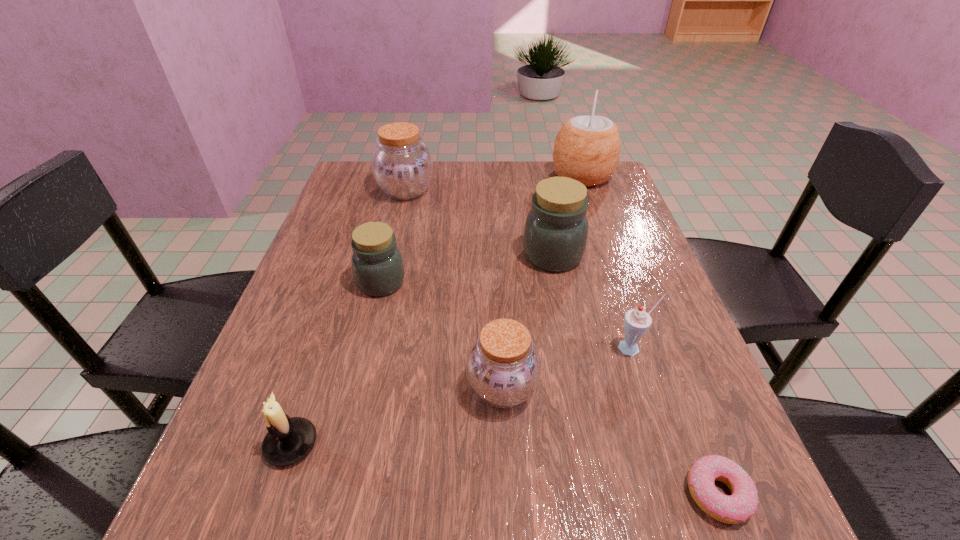
You are a GUI agent. You are given a task and a screenshot of the screen. Output one action in this format:
    pyautogui.click(x=<x>, y=<y>)
    Task: Click on the coconut located in the far edge section of the desktop
    Image resolution: width=960 pixels, height=540 pixels.
    Given the screenshot: What is the action you would take?
    pyautogui.click(x=587, y=148)

This screenshot has height=540, width=960. I want to click on jar that is at the far edge, so click(x=402, y=165).

Locate an element on the screen. The width and height of the screenshot is (960, 540). object that is at the near edge is located at coordinates (742, 504).

Identify the location of candle holder present at the left edge. (288, 440).

The width and height of the screenshot is (960, 540). What are the coordinates of `coconut that is at the right edge` in the screenshot? It's located at (587, 148).

Where is `jar positioned at the right edge`? jar positioned at the right edge is located at coordinates (556, 229).

What are the coordinates of `milkshake at the right edge` in the screenshot? It's located at (636, 321).

Identify the location of doughnut situated at the right edge. Image resolution: width=960 pixels, height=540 pixels. (742, 504).

This screenshot has width=960, height=540. Identify the location of object that is at the far left corner. (402, 165).

Locate an element on the screen. The image size is (960, 540). object situated at the far right corner is located at coordinates (587, 148).